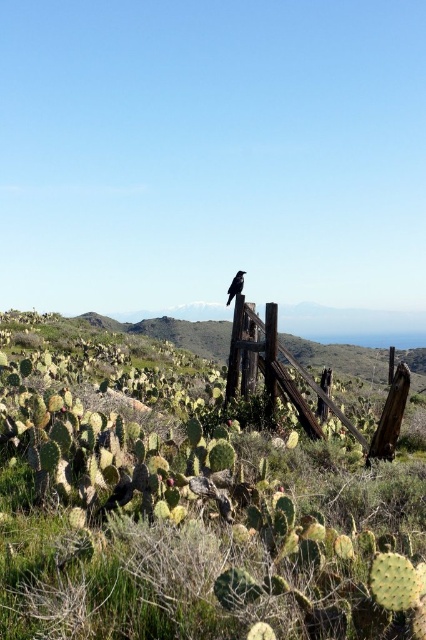
Question: Is green spiny cactus at center bigger than rusty wood fence at center?

Choices:
 (A) yes
 (B) no

Answer: (A)

Question: Does rusty wood fence at center have a smaller size compared to black glossy bird at upper center?

Choices:
 (A) no
 (B) yes

Answer: (A)

Question: Does rusty wood fence at center lie in front of black glossy bird at upper center?

Choices:
 (A) yes
 (B) no

Answer: (A)

Question: Estimate the real-world distances between objects in this image. Which object is closer to the green spiny cactus at center?

Choices:
 (A) rusty wood fence at center
 (B) black glossy bird at upper center

Answer: (B)

Question: Based on their relative distances, which object is nearer to the green spiny cactus at center?

Choices:
 (A) rusty wood fence at center
 (B) black glossy bird at upper center

Answer: (B)

Question: Which point is closer to the camera taking this photo?

Choices:
 (A) (233, 296)
 (B) (276, 349)

Answer: (B)